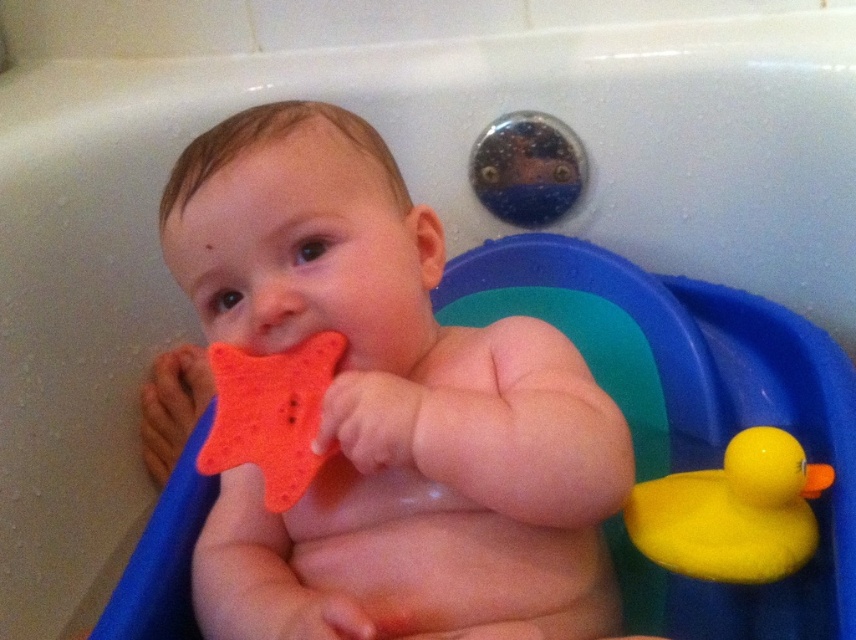
Is rubber duck at right taller than orange sponge star at center?

No, rubber duck at right is not taller than orange sponge star at center.

Consider the image. Is rubber duck at right bigger than orange sponge star at center?

No.

Where is `rubber duck at right`? The height and width of the screenshot is (640, 856). rubber duck at right is located at coordinates (733, 512).

Locate an element on the screen. Image resolution: width=856 pixels, height=640 pixels. rubber duck at right is located at coordinates (733, 512).

Is orange sponge at center above orange sponge star at center?

Incorrect, orange sponge at center is not positioned above orange sponge star at center.

Does orange sponge at center have a lesser width compared to orange sponge star at center?

Result: No.

What do you see at coordinates (387, 410) in the screenshot? The width and height of the screenshot is (856, 640). I see `orange sponge at center` at bounding box center [387, 410].

Where is `orange sponge at center`? This screenshot has height=640, width=856. orange sponge at center is located at coordinates (387, 410).

Between point (165, 435) and point (768, 509), which one is positioned in front?

Point (768, 509) is more forward.

Is orange sponge at center below rubber duck at right?

No.

Locate an element on the screen. This screenshot has height=640, width=856. orange sponge at center is located at coordinates (387, 410).

Where is `orange sponge at center`? This screenshot has height=640, width=856. orange sponge at center is located at coordinates (387, 410).